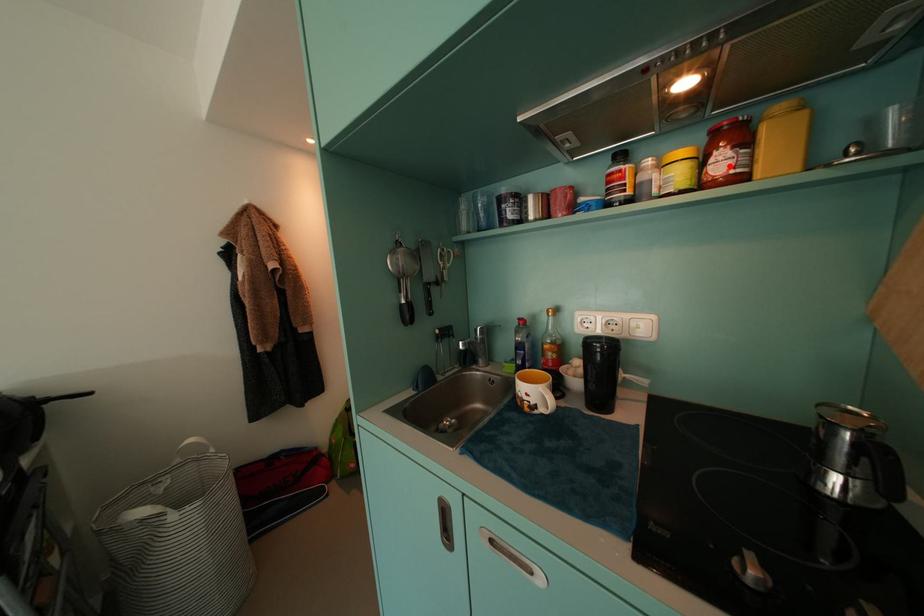
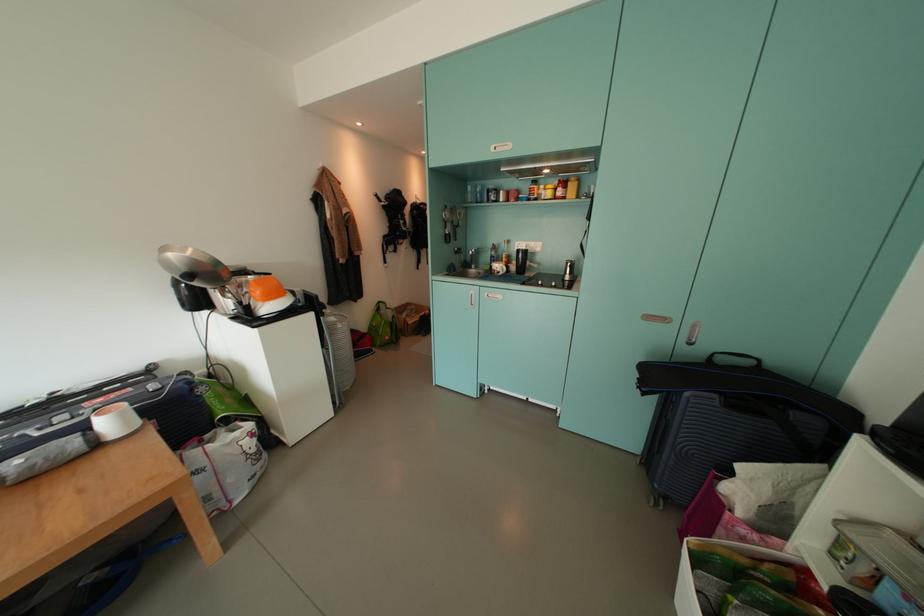
Question: I am providing you with two images of the same scene from different viewpoints. A red point is shown in image1. For the corresponding object point in image2, is it positioned nearer or farther from the camera?

Choices:
 (A) Nearer
 (B) Farther

Answer: (A)